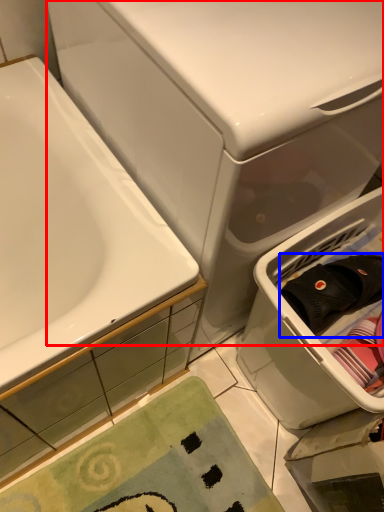
Question: Among these objects, which one is nearest to the camera, water tank (highlighted by a red box) or clothing (highlighted by a blue box)?

Choices:
 (A) water tank
 (B) clothing

Answer: (A)